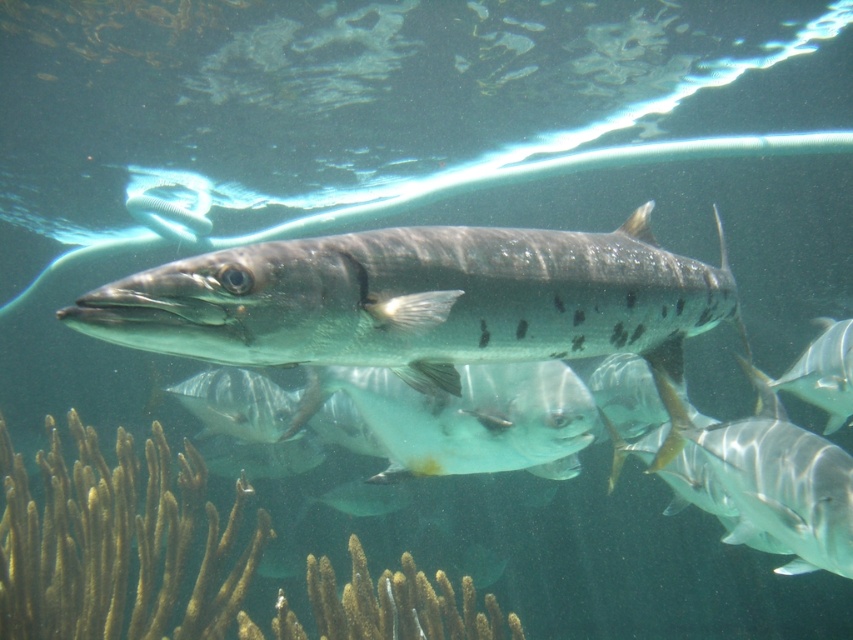
In the scene shown: You are a scuba diver observing the underwater scene. You notice two points marked in the image. The first point is at coordinates point (669, 323), and the second is at point (396, 468). Which point is closer to you as you look at the image?

Point (669, 323) is closer to the viewer than point (396, 468).

You are a scuba diver holding a 2.5 meter long measuring tape. You want to reach the point at coordinates (268, 528) in the underwater scene. Can you reach it with your measuring tape?

The point at coordinates (268, 528) is 3.18 meters away from the camera. Since your measuring tape is only 2.5 meters long, you cannot reach it with your measuring tape.